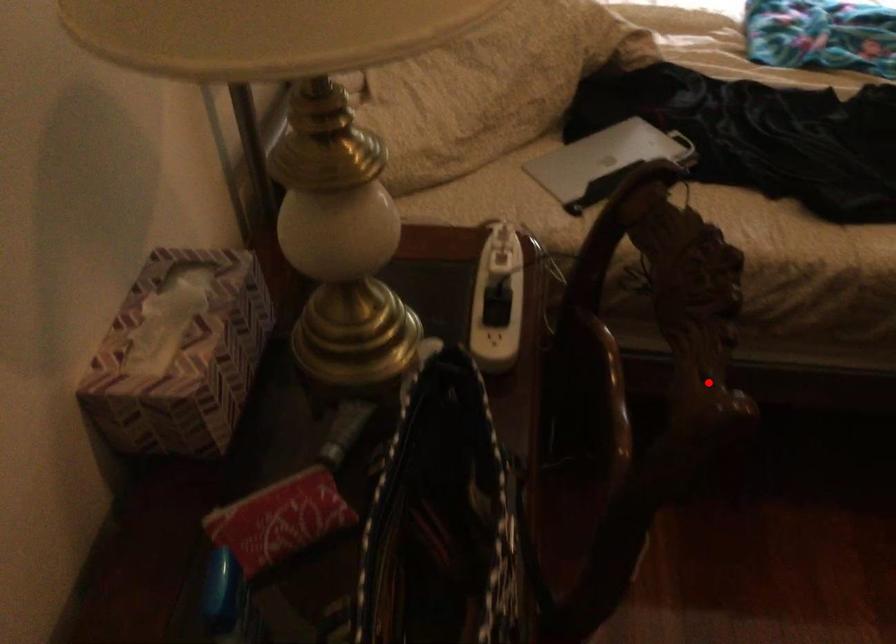
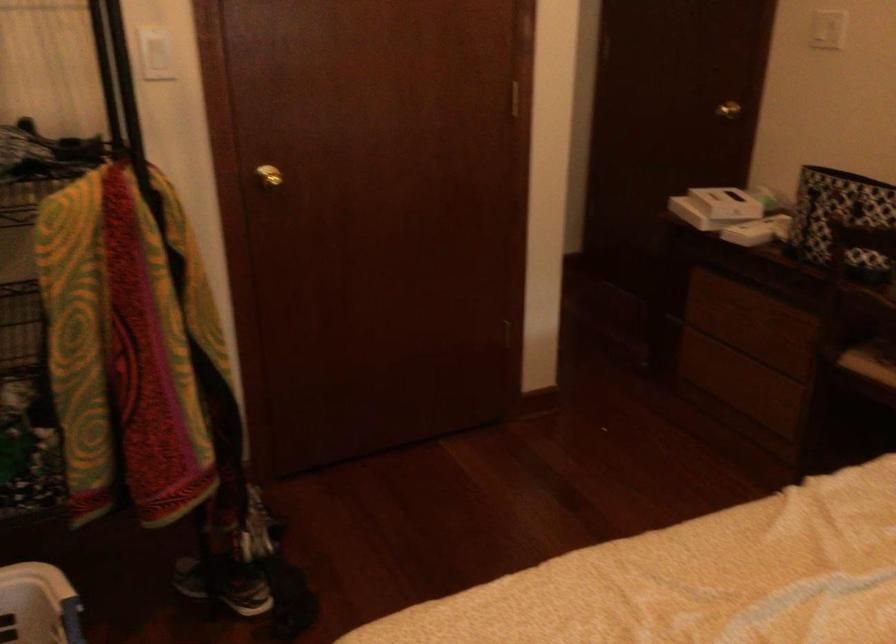
Question: I am providing you with two images of the same scene from different viewpoints. Given a red point in image1, look at the same physical point in image2. Is it:

Choices:
 (A) Closer to the viewpoint
 (B) Farther from the viewpoint

Answer: (B)